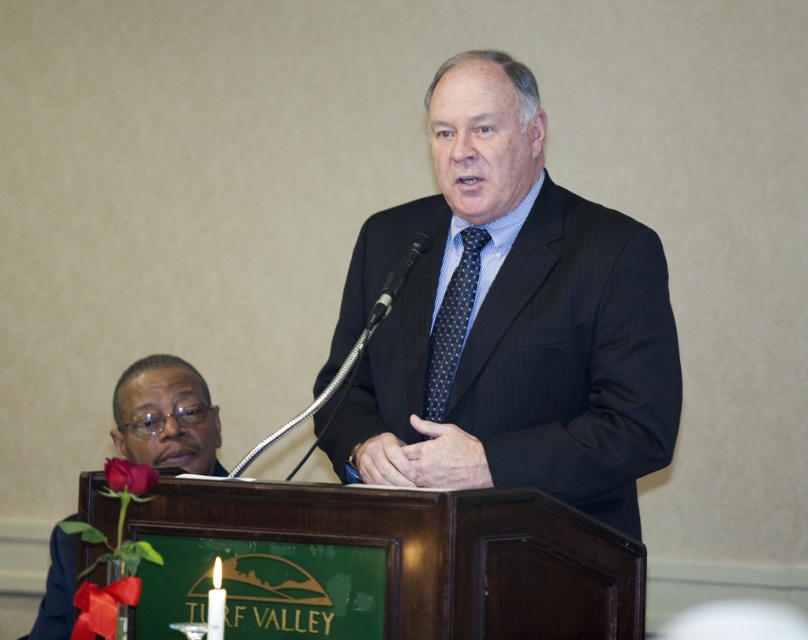
What do you see at coordinates (451, 323) in the screenshot?
I see `dark blue dotted tie at center` at bounding box center [451, 323].

Find the location of a particular element. This screenshot has height=640, width=808. dark blue dotted tie at center is located at coordinates (451, 323).

Is matte black suit at lower left further to the viewer compared to dark blue dotted tie at center?

Yes, matte black suit at lower left is further from the viewer.

Who is lower down, matte black suit at lower left or dark blue dotted tie at center?

matte black suit at lower left is lower down.

Is point (215, 422) positioned in front of point (447, 356)?

No, it is behind (447, 356).

Identify the location of matte black suit at lower left. (165, 416).

Is dark pinstripe suit at center smaller than black metallic microphone at center?

No, dark pinstripe suit at center is not smaller than black metallic microphone at center.

Is point (489, 148) positioned after point (375, 308)?

Yes, it is.

Who is more forward, (592,371) or (406,275)?

Point (592,371) is in front.

Find the location of a particular element. This screenshot has height=640, width=808. dark pinstripe suit at center is located at coordinates pyautogui.click(x=508, y=321).